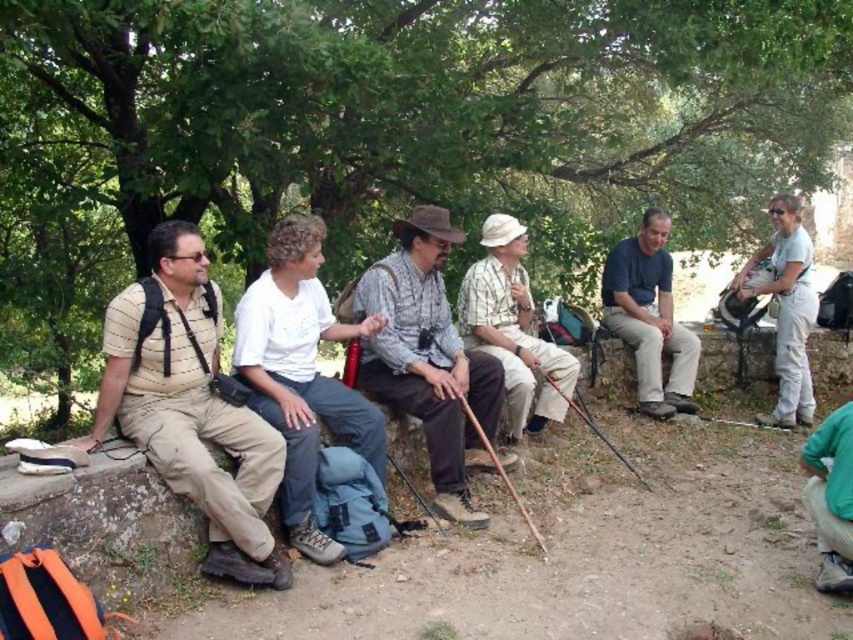
Is checkered fabric shirt at center behind green fabric pants at lower right?

Yes, it is.

Which is more to the right, checkered fabric shirt at center or green fabric pants at lower right?

From the viewer's perspective, green fabric pants at lower right appears more on the right side.

Does point (570, 355) lie in front of point (843, 520)?

No, it is not.

Locate an element on the screen. The width and height of the screenshot is (853, 640). checkered fabric shirt at center is located at coordinates (514, 328).

Can you confirm if white cotton shirt at center is positioned below dark blue shirt at center?

Yes, white cotton shirt at center is below dark blue shirt at center.

Who is higher up, white cotton shirt at center or dark blue shirt at center?

dark blue shirt at center is above.

Who is more forward, (x=267, y=403) or (x=631, y=276)?

Point (x=267, y=403)

The width and height of the screenshot is (853, 640). What are the coordinates of `white cotton shirt at center` in the screenshot? It's located at (302, 372).

What do you see at coordinates (390, 129) in the screenshot? This screenshot has height=640, width=853. I see `green leafy tree at upper center` at bounding box center [390, 129].

Is green leafy tree at upper center to the left of plaid cotton shirt at center from the viewer's perspective?

No, green leafy tree at upper center is not to the left of plaid cotton shirt at center.

Is point (775, 48) positioned in front of point (440, 387)?

No.

This screenshot has height=640, width=853. I want to click on green leafy tree at upper center, so click(x=390, y=129).